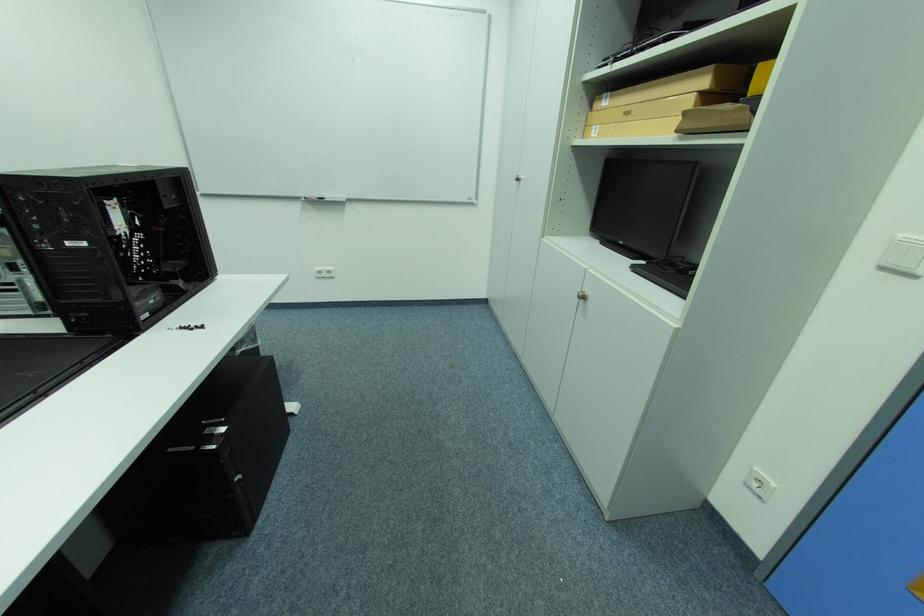
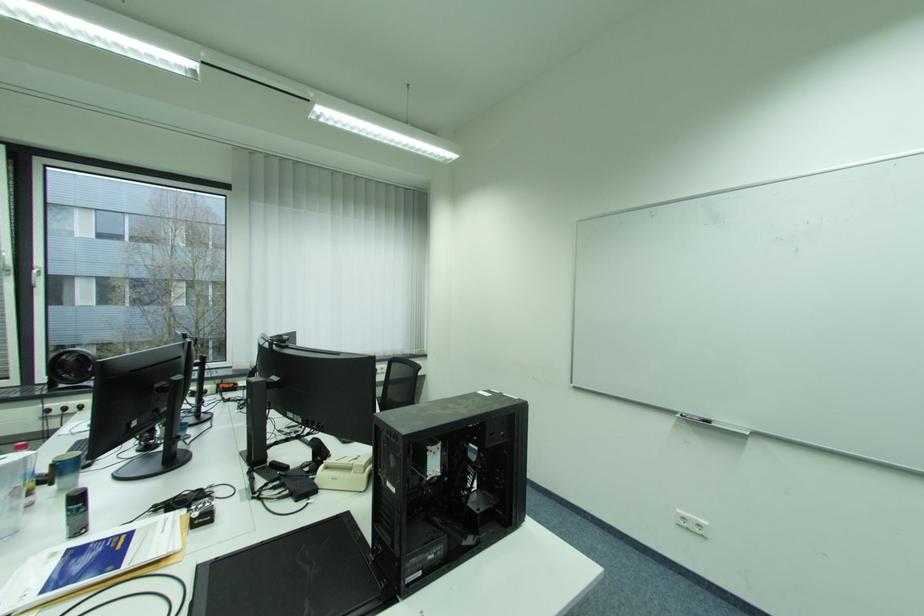
Question: The camera is either moving clockwise (left) or counter-clockwise (right) around the object. The first image is from the beginning of the video and the second image is from the end. Is the camera moving left or right when shooting the video?

Choices:
 (A) Left
 (B) Right

Answer: (B)